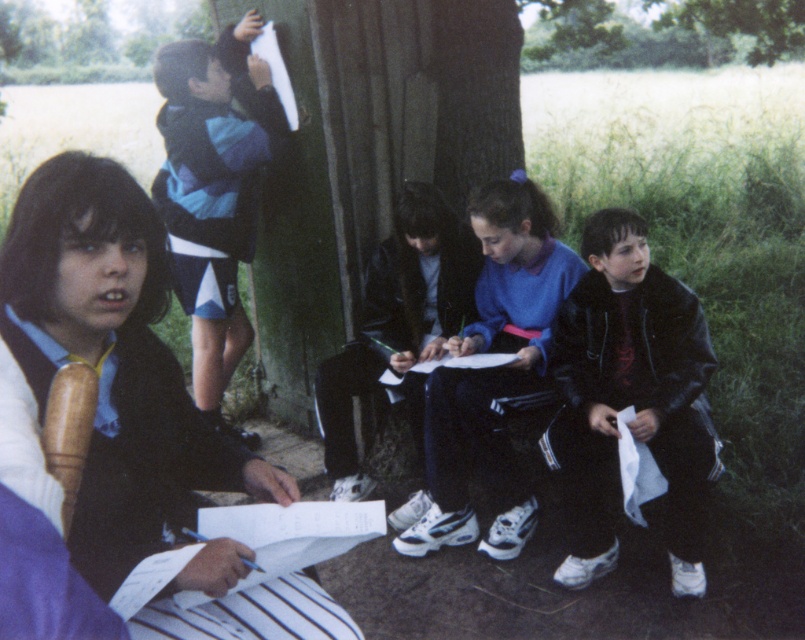
You are a photographer trying to capture a group photo of the children in the scene. You want to ensure that both the blue striped shirt at upper left and the dark blue jacket at center are clearly visible in the frame. Based on their positions, which child should be positioned to the left in the photo?

The blue striped shirt at upper left should be positioned to the left in the photo since it is already to the left of the dark blue jacket at center in the scene.

You are a photographer trying to capture a group photo of the children in the scene. You want to ensure that both the blue striped shirt at upper left and the dark blue jacket at center are fully visible in the photo. Given their positions and sizes, which child should you position closer to the camera to avoid any obstruction?

The blue striped shirt at upper left is much taller than the dark blue jacket at center. To ensure both are fully visible, position the dark blue jacket at center closer to the camera so the taller blue striped shirt at upper left doesn